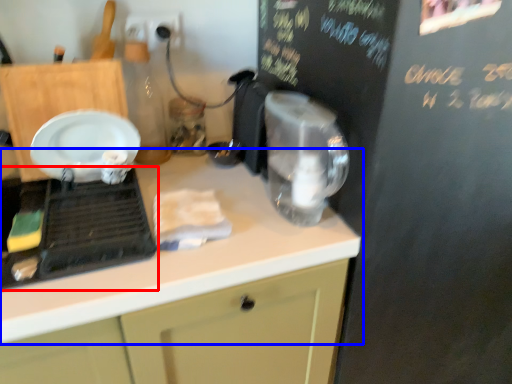
Question: Among these objects, which one is farthest to the camera, home appliance (highlighted by a red box) or countertop (highlighted by a blue box)?

Choices:
 (A) home appliance
 (B) countertop

Answer: (A)